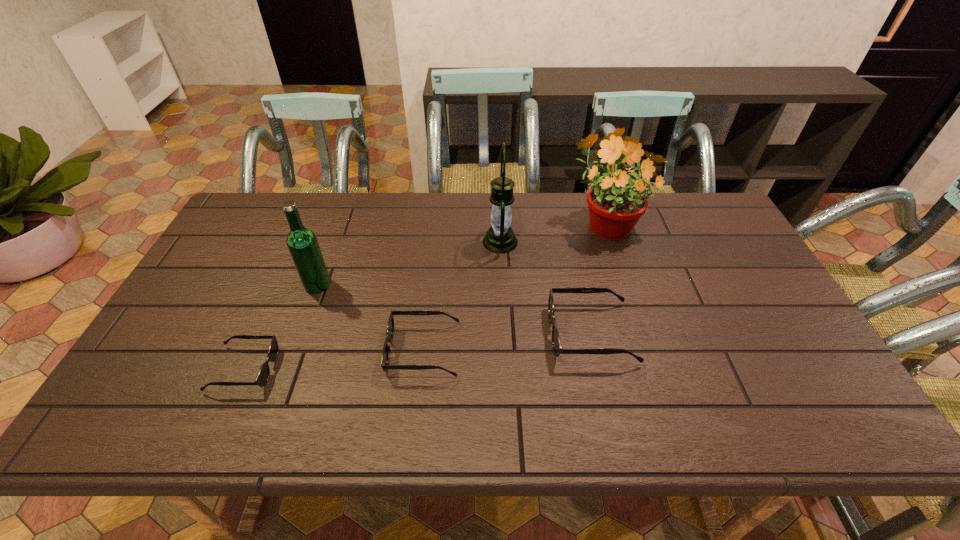
Identify the location of vacant area that lies between the second shortest object and the lantern. This screenshot has width=960, height=540. (462, 296).

This screenshot has width=960, height=540. Find the location of `empty space that is in between the beer bottle and the fourth object from left to right`. empty space that is in between the beer bottle and the fourth object from left to right is located at coordinates (409, 263).

In order to click on free area in between the third farthest object and the lantern in this screenshot , I will do `click(409, 263)`.

The height and width of the screenshot is (540, 960). In order to click on vacant area that lies between the shortest object and the flowerpot in this screenshot , I will do `click(424, 296)`.

What are the coordinates of `vacant point located between the third tallest object and the shortest sunglasses` in the screenshot? It's located at (280, 327).

Find the location of `vacant area that lies between the third tallest object and the second sunglasses from right to left`. vacant area that lies between the third tallest object and the second sunglasses from right to left is located at coordinates (371, 318).

Locate an element on the screen. Image resolution: width=960 pixels, height=540 pixels. vacant point located between the second sunglasses from right to left and the rightmost sunglasses is located at coordinates (507, 342).

I want to click on vacant area that lies between the third object from right to left and the flowerpot, so click(553, 232).

Find the location of a particular element. This screenshot has height=540, width=960. free space between the shortest sunglasses and the fourth shortest object is located at coordinates (280, 327).

The image size is (960, 540). What are the coordinates of `blank region between the flowerpot and the tallest sunglasses` in the screenshot? It's located at (598, 278).